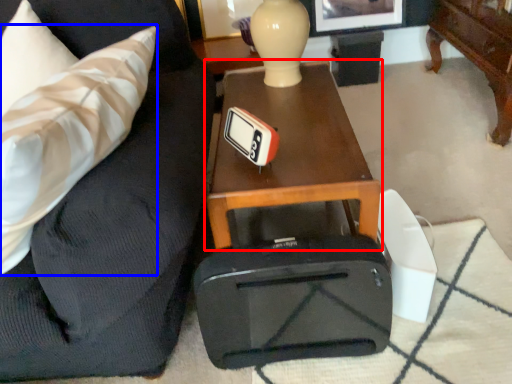
Question: Among these objects, which one is farthest to the camera, table (highlighted by a red box) or throw pillow (highlighted by a blue box)?

Choices:
 (A) table
 (B) throw pillow

Answer: (A)